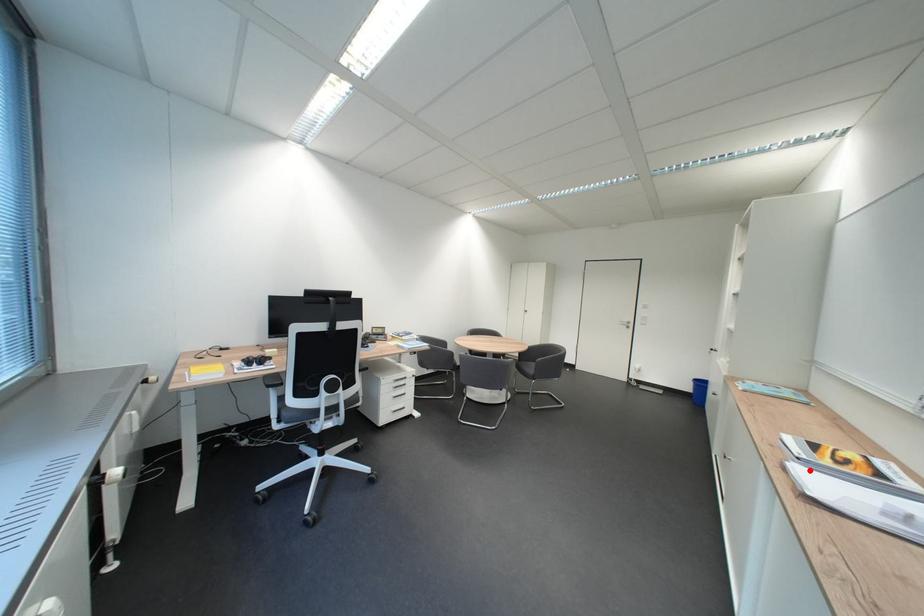
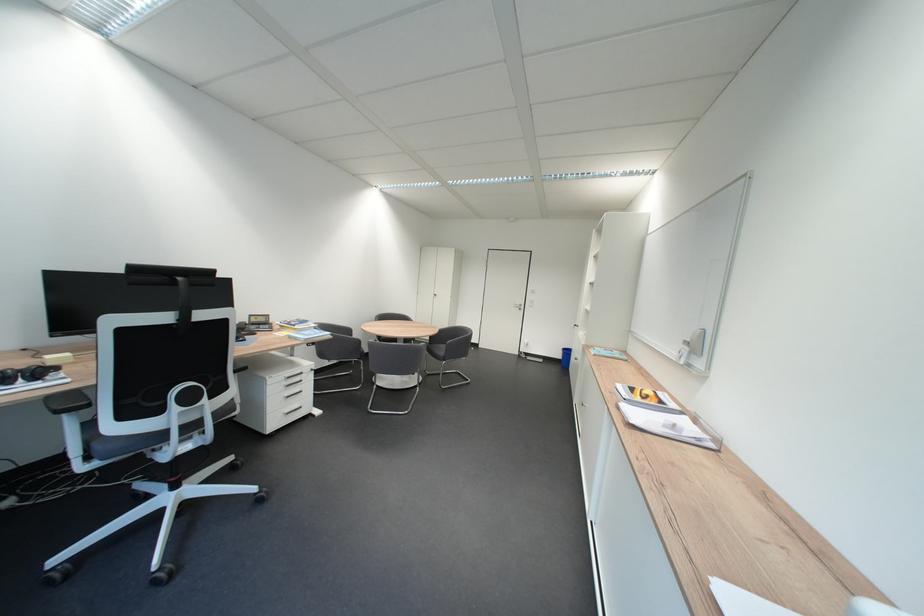
Locate, in the second image, the point that corresponds to the highlighted location in the first image.

(637, 408)